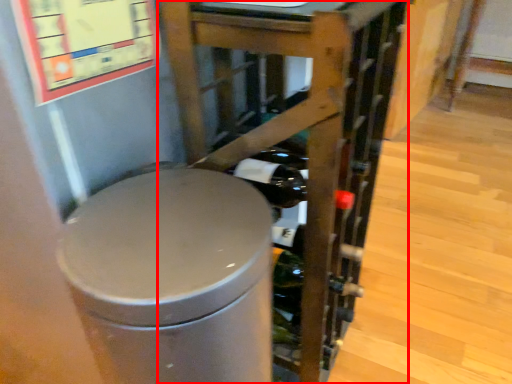
Question: From the image's perspective, where is furniture (annotated by the red box) located in relation to waste container in the image?

Choices:
 (A) below
 (B) above

Answer: (B)